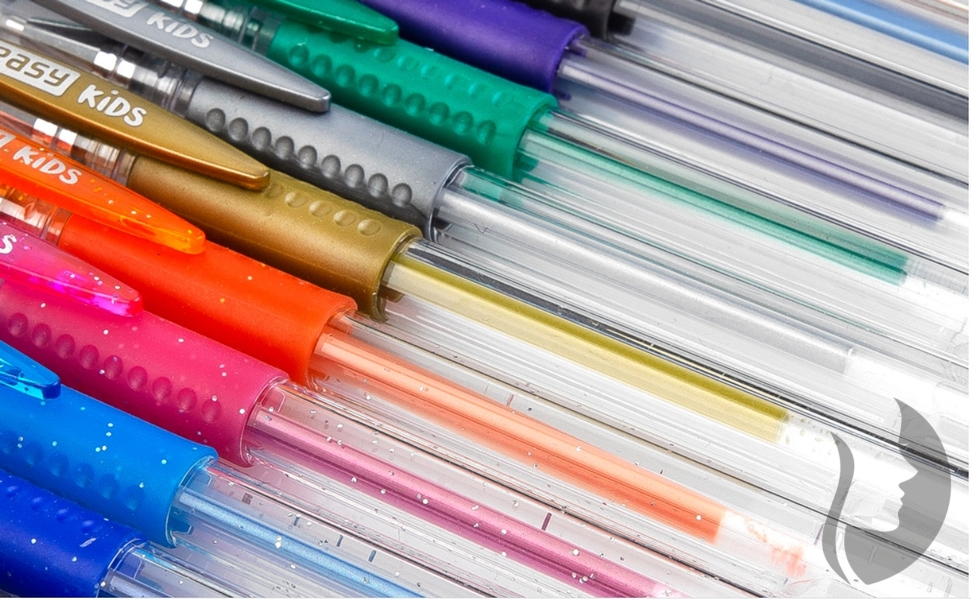
The width and height of the screenshot is (971, 600). I want to click on silicone pen grips, so click(51, 540), click(109, 452), click(179, 392), click(272, 277), click(323, 216), click(387, 153), click(453, 108), click(512, 38), click(589, 13).